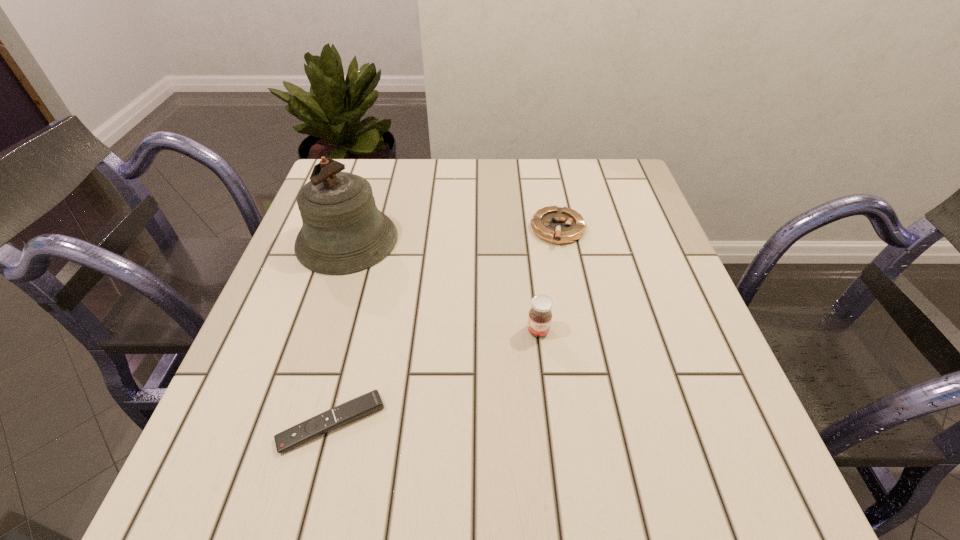
The height and width of the screenshot is (540, 960). I want to click on unoccupied position between the tallest object and the third farthest object, so click(443, 286).

Find the location of a particular element. This screenshot has height=540, width=960. object that is the second closest to the ashtray is located at coordinates (343, 232).

Locate an element on the screen. This screenshot has width=960, height=540. object that stands as the closest to the ashtray is located at coordinates (540, 315).

At what (x,y) coordinates should I click in order to perform the action: click on vacant region that satisfies the following two spatial constraints: 1. on the back side of the second shortest object; 2. on the right side of the nearest object. Please return your answer as a coordinate pair (x, y). Looking at the image, I should click on (380, 230).

This screenshot has width=960, height=540. Identify the location of free spot that satisfies the following two spatial constraints: 1. on the back side of the ashtray; 2. on the left side of the shortest object. (380, 230).

The image size is (960, 540). Identify the location of vacant region that satisfies the following two spatial constraints: 1. on the front side of the bell; 2. on the left side of the shortest object. (287, 423).